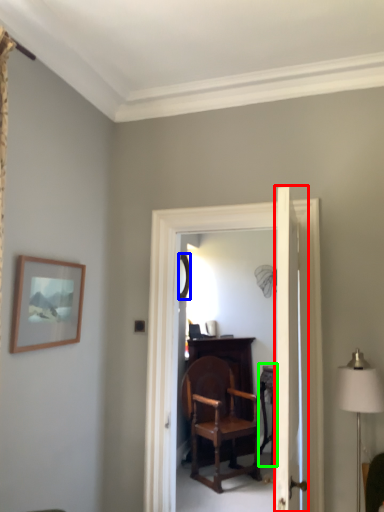
Question: Which object is positioned farthest from door (highlighted by a red box)? Select from mirror (highlighted by a blue box) and table (highlighted by a green box).

Choices:
 (A) mirror
 (B) table

Answer: (A)